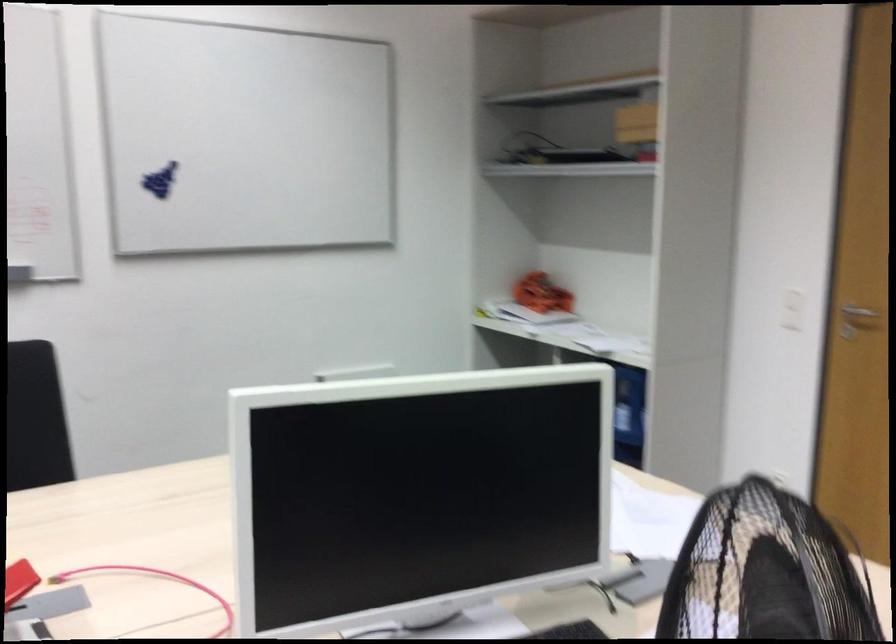
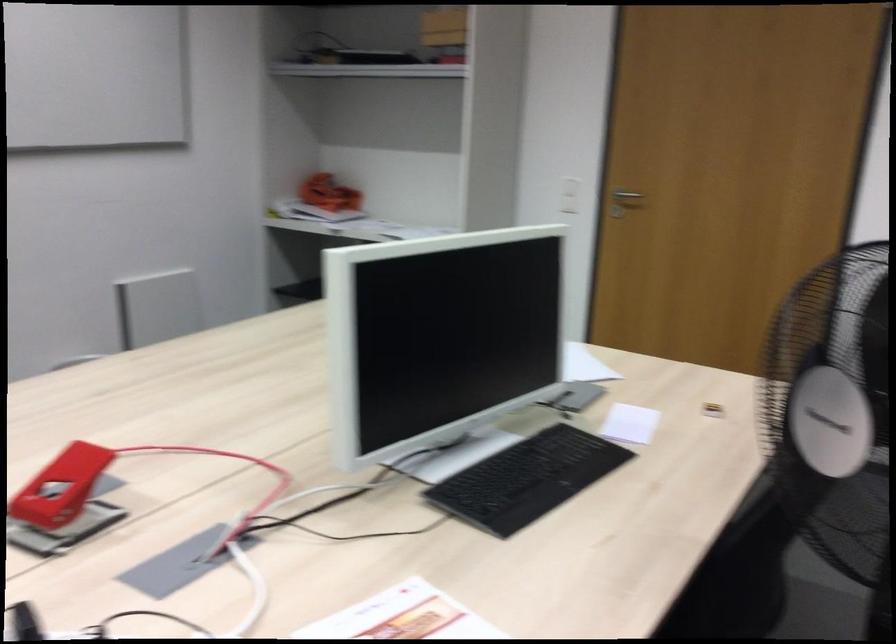
The point at (787, 308) is marked in the first image. Where is the corresponding point in the second image?

(569, 194)